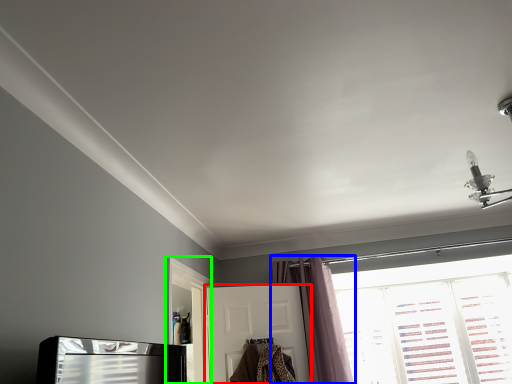
Question: Which object is positioned farthest from door (highlighted by a red box)? Select from curtain (highlighted by a blue box) and screen door (highlighted by a green box).

Choices:
 (A) curtain
 (B) screen door

Answer: (B)